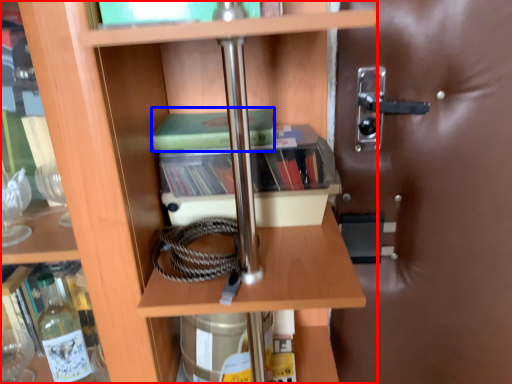
Question: Which point is closer to the camera, shelf (highlighted by a red box) or paperback book (highlighted by a blue box)?

Choices:
 (A) shelf
 (B) paperback book

Answer: (A)